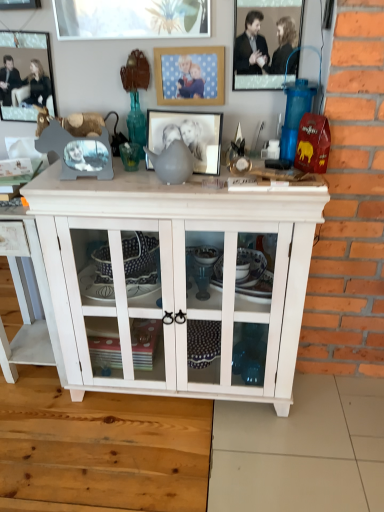
Question: From the image's perspective, does metallic silver picture frame at upper left, the 5th picture frame viewed from the right, appear higher than matte gray picture frame at center, marked as the 3th picture frame in a left-to-right arrangement?

Choices:
 (A) no
 (B) yes

Answer: (B)

Question: Is matte gray picture frame at center, marked as the 3th picture frame in a right-to-left arrangement, at the back of metallic silver picture frame at upper left, placed as the first picture frame when sorted from left to right?

Choices:
 (A) yes
 (B) no

Answer: (B)

Question: From a real-world perspective, is metallic silver picture frame at upper left, the 5th picture frame viewed from the right, located higher than matte gray picture frame at center, marked as the 3th picture frame in a right-to-left arrangement?

Choices:
 (A) yes
 (B) no

Answer: (A)

Question: Is metallic silver picture frame at upper left, the 5th picture frame viewed from the right, not inside matte gray picture frame at center, marked as the 3th picture frame in a left-to-right arrangement?

Choices:
 (A) yes
 (B) no

Answer: (A)

Question: Can you confirm if metallic silver picture frame at upper left, placed as the first picture frame when sorted from left to right, is thinner than matte gray picture frame at center, marked as the 3th picture frame in a left-to-right arrangement?

Choices:
 (A) no
 (B) yes

Answer: (B)

Question: In terms of width, does brushed metal picture frame at upper left, arranged as the fourth picture frame when viewed from the right, look wider or thinner when compared to metallic silver picture frame at upper center, the 5th picture frame viewed from the left?

Choices:
 (A) wide
 (B) thin

Answer: (A)

Question: Relative to metallic silver picture frame at upper center, which ranks as the 1th picture frame in right-to-left order, is brushed metal picture frame at upper left, the second picture frame from the left, in front or behind?

Choices:
 (A) behind
 (B) front

Answer: (B)

Question: Is point (39, 3) positioned closer to the camera than point (253, 41)?

Choices:
 (A) closer
 (B) farther

Answer: (B)

Question: From the image's perspective, is brushed metal picture frame at upper left, the second picture frame from the left, above or below metallic silver picture frame at upper center, the 5th picture frame viewed from the left?

Choices:
 (A) below
 (B) above

Answer: (B)

Question: Is point (4, 100) closer or farther from the camera than point (16, 343)?

Choices:
 (A) closer
 (B) farther

Answer: (A)

Question: In terms of height, does metallic silver picture frame at upper left, the 5th picture frame viewed from the right, look taller or shorter compared to white wood cabinet at center, the 2th table from the right?

Choices:
 (A) tall
 (B) short

Answer: (B)

Question: Would you say metallic silver picture frame at upper left, the 5th picture frame viewed from the right, is to the left or to the right of white wood cabinet at center, the 2th table from the right, in the picture?

Choices:
 (A) left
 (B) right

Answer: (B)

Question: Relative to white wood cabinet at center, the 1th table in the left-to-right sequence, is metallic silver picture frame at upper left, placed as the first picture frame when sorted from left to right, in front or behind?

Choices:
 (A) front
 (B) behind

Answer: (B)

Question: Considering the relative positions of matte gray picture frame at center, marked as the 3th picture frame in a right-to-left arrangement, and metallic silver picture frame at upper left, the 5th picture frame viewed from the right, in the image provided, is matte gray picture frame at center, marked as the 3th picture frame in a right-to-left arrangement, to the left or to the right of metallic silver picture frame at upper left, the 5th picture frame viewed from the right,?

Choices:
 (A) left
 (B) right

Answer: (B)

Question: Looking at the image, does matte gray picture frame at center, marked as the 3th picture frame in a left-to-right arrangement, seem bigger or smaller compared to metallic silver picture frame at upper left, the 5th picture frame viewed from the right?

Choices:
 (A) small
 (B) big

Answer: (B)